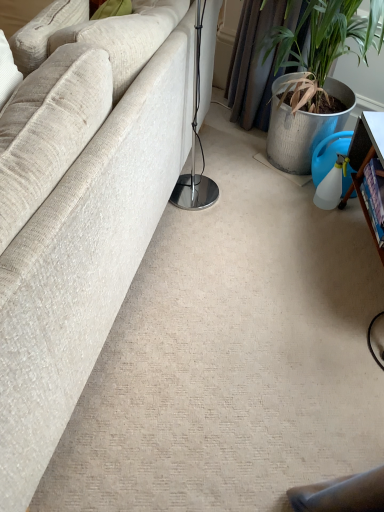
Question: Should I look upward or downward to see beige fabric couch at left?

Choices:
 (A) down
 (B) up

Answer: (B)

Question: Can you confirm if beige fabric couch at left is shorter than wooden bookshelf at right?

Choices:
 (A) yes
 (B) no

Answer: (B)

Question: Is beige fabric couch at left smaller than wooden bookshelf at right?

Choices:
 (A) yes
 (B) no

Answer: (B)

Question: Could wooden bookshelf at right be considered to be inside beige fabric couch at left?

Choices:
 (A) yes
 (B) no

Answer: (B)

Question: Is beige fabric couch at left next to wooden bookshelf at right and touching it?

Choices:
 (A) no
 (B) yes

Answer: (A)

Question: Is beige fabric couch at left facing towards wooden bookshelf at right?

Choices:
 (A) no
 (B) yes

Answer: (A)

Question: Are beige fabric couch at left and wooden bookshelf at right far apart?

Choices:
 (A) no
 (B) yes

Answer: (A)

Question: Is wooden bookshelf at right next to beige fabric couch at left and touching it?

Choices:
 (A) no
 (B) yes

Answer: (A)

Question: From the image's perspective, is wooden bookshelf at right located beneath beige fabric couch at left?

Choices:
 (A) no
 (B) yes

Answer: (B)

Question: Can beige fabric couch at left be found inside wooden bookshelf at right?

Choices:
 (A) no
 (B) yes

Answer: (A)

Question: Is wooden bookshelf at right at the left side of beige fabric couch at left?

Choices:
 (A) yes
 (B) no

Answer: (B)

Question: Can you confirm if wooden bookshelf at right is thinner than beige fabric couch at left?

Choices:
 (A) yes
 (B) no

Answer: (A)

Question: Is the depth of wooden bookshelf at right greater than that of beige fabric couch at left?

Choices:
 (A) no
 (B) yes

Answer: (B)

Question: Considering the positions of wooden bookshelf at right and beige fabric couch at left in the image, is wooden bookshelf at right wider or thinner than beige fabric couch at left?

Choices:
 (A) thin
 (B) wide

Answer: (A)